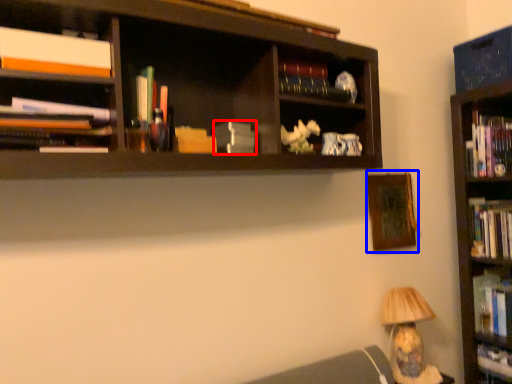
Question: Which point is further to the camera, paperback book (highlighted by a red box) or picture frame (highlighted by a blue box)?

Choices:
 (A) paperback book
 (B) picture frame

Answer: (B)